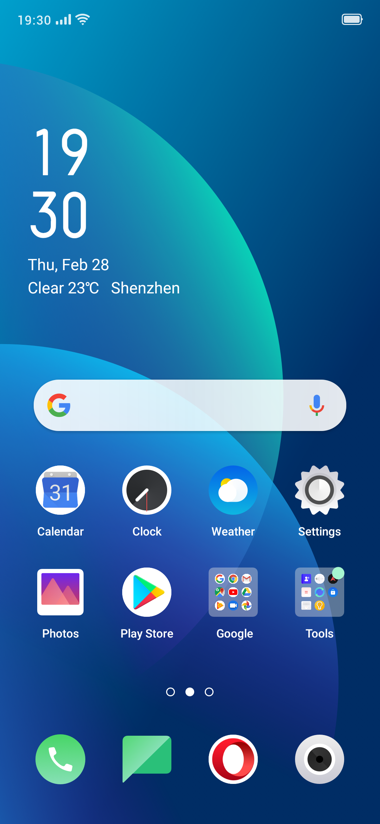
Image resolution: width=380 pixels, height=824 pixels. What are the coordinates of `white phone` in the screenshot? It's located at (51, 751).